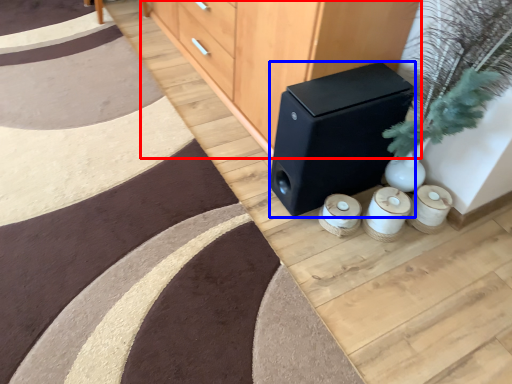
Question: Which point is closer to the camera, furniture (highlighted by a red box) or speaker (highlighted by a blue box)?

Choices:
 (A) furniture
 (B) speaker

Answer: (A)